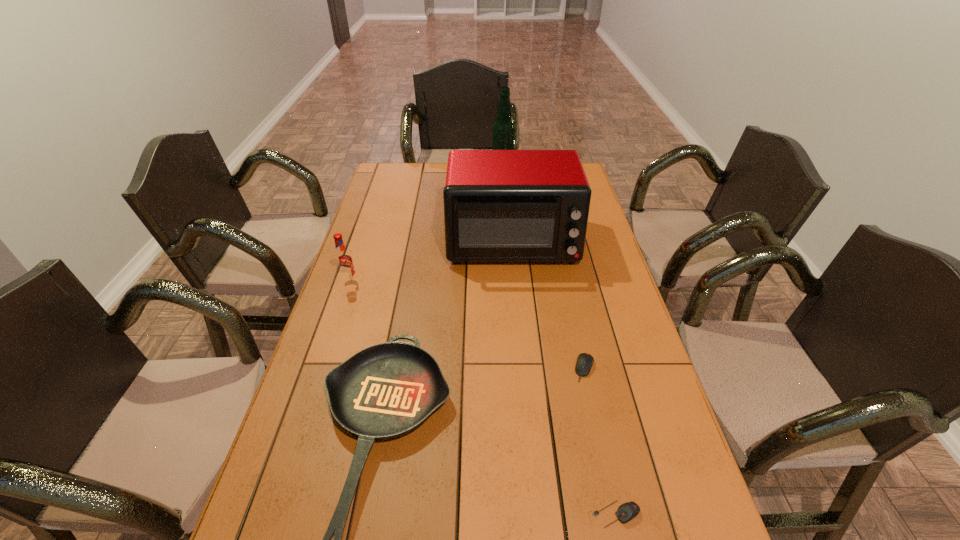
Image resolution: width=960 pixels, height=540 pixels. I want to click on vacant area situated 0.180m on the front of the alcohol, so click(x=504, y=200).

Image resolution: width=960 pixels, height=540 pixels. In order to click on free space located on the front-facing side of the toaster oven in this screenshot , I will do `click(520, 334)`.

You are a GUI agent. You are given a task and a screenshot of the screen. Output one action in this format:
    pyautogui.click(x=<x>, y=<y>)
    Task: Click on the vacant space located 0.120m on the front of the fourth shortest object
    Image resolution: width=960 pixels, height=540 pixels.
    Given the screenshot: What is the action you would take?
    pyautogui.click(x=338, y=314)

Image resolution: width=960 pixels, height=540 pixels. What are the coordinates of `blank space located on the left of the second shortest object` in the screenshot? It's located at (552, 368).

Find the location of `free spot located 0.090m on the right of the shorter mouse`. free spot located 0.090m on the right of the shorter mouse is located at coordinates (684, 514).

Find the location of a particular element. Image resolution: width=960 pixels, height=540 pixels. object that is positioned at the far edge is located at coordinates (503, 133).

Find the location of `object situated at the left edge`. object situated at the left edge is located at coordinates (343, 260).

Where is `toaster oven located in the right edge section of the desktop`? Image resolution: width=960 pixels, height=540 pixels. toaster oven located in the right edge section of the desktop is located at coordinates (499, 205).

Find the location of `vacant point at the far edge`. vacant point at the far edge is located at coordinates (423, 162).

What are the coordinates of `free space at the left edge of the desktop` in the screenshot? It's located at (348, 295).